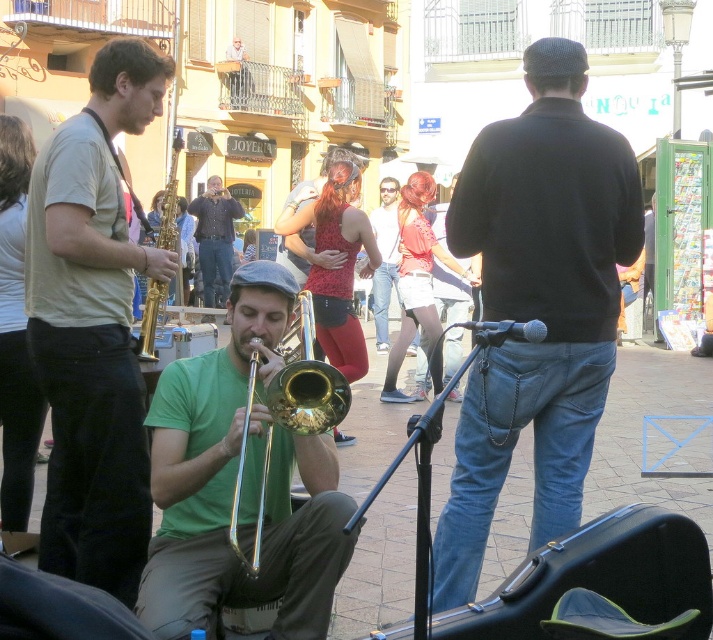
You are a photographer trying to capture a clear shot of both the black matte sweater at center and the gold shiny trumpet at center. Since you want both subjects to be in focus, you need to adjust your camera settings. Which object should you focus on to ensure both are sharp?

You should focus on the black matte sweater at center because it is in front of the gold shiny trumpet at center. By focusing on the closer object, you can maximize the depth of field to include both in focus.

You are a photographer standing at the origin point of the image coordinate system. The image coordinate system has its origin at the bottom left corner. You want to take a photo of the green matte trombone at center. What are the coordinates of the trombone?

The coordinates of the green matte trombone at center are at point (241, 484).